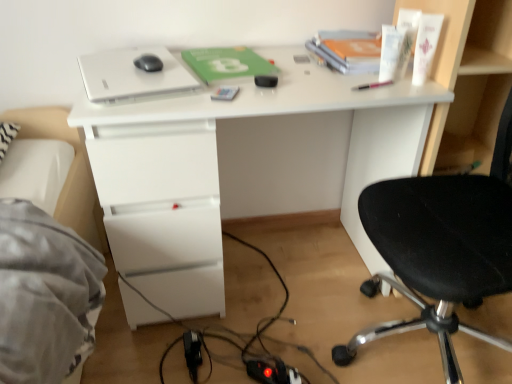
Locate an element on the screen. The height and width of the screenshot is (384, 512). unoccupied space behind pink plastic pen at upper right, which is the second stationery from left to right is located at coordinates (352, 72).